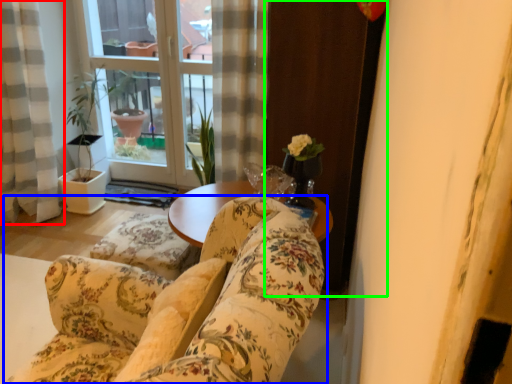
Question: Considering the real-world distances, which object is farthest from curtain (highlighted by a red box)? studio couch (highlighted by a blue box) or screen door (highlighted by a green box)?

Choices:
 (A) studio couch
 (B) screen door

Answer: (A)